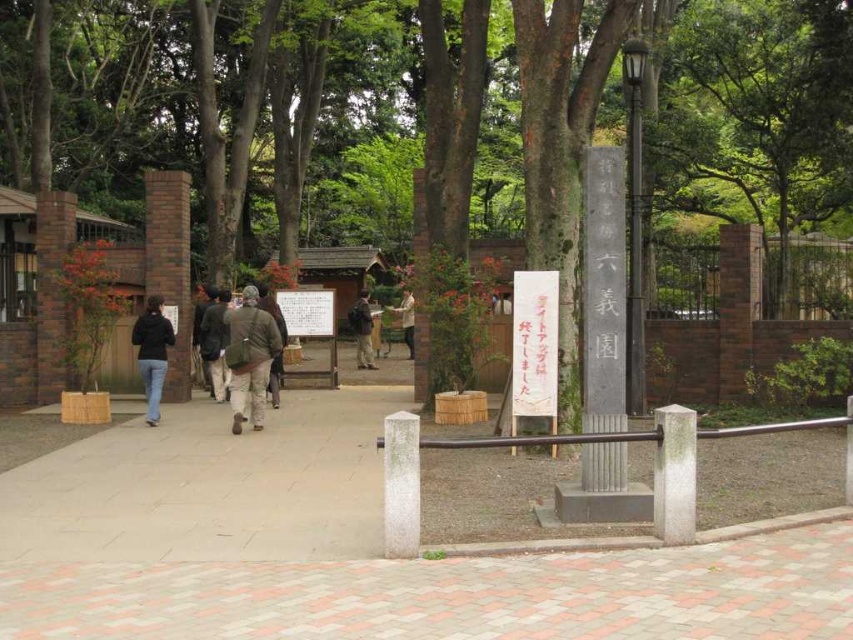
You are a tourist in the park and want to take a photo of the camouflage jacket at center without the polished metal pole at upper right blocking the view. How should you position yourself?

Move to the left side so that the polished metal pole at upper right is out of the frame, allowing the camouflage jacket at center to be visible without obstruction.

You are standing on the paved walkway and want to place your dark brown backpack at center so that it is hidden from view from the monument on the right. Where should you position it relative to the green leafy tree at center?

Place the dark brown backpack at center behind the green leafy tree at center, as the tree is closer to the viewer. This will block the backpack from the monument on the right side.